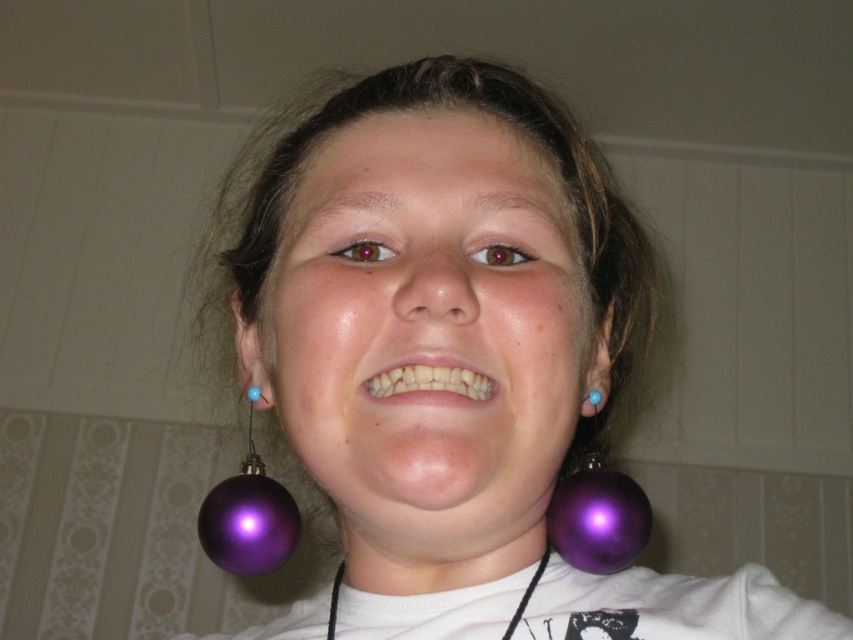
Question: Is shiny purple earrings at center further to the viewer compared to purple glossy ball at lower right?

Choices:
 (A) yes
 (B) no

Answer: (B)

Question: Which object appears closest to the camera in this image?

Choices:
 (A) purple glossy ball at left
 (B) purple glossy ball at lower right

Answer: (B)

Question: Is purple glossy ball at lower right below white glossy teeth at center?

Choices:
 (A) no
 (B) yes

Answer: (B)

Question: Which point is closer to the camera taking this photo?

Choices:
 (A) tap(512, 628)
 (B) tap(595, 392)
 (C) tap(370, 380)
 (D) tap(341, 120)

Answer: (C)

Question: Which point appears farthest from the camera in this image?

Choices:
 (A) (332, 588)
 (B) (595, 388)
 (C) (387, 385)
 (D) (558, 508)

Answer: (A)

Question: Observing the image, what is the correct spatial positioning of purple glossy ball at left in reference to purple glossy ball at right?

Choices:
 (A) above
 (B) below

Answer: (B)